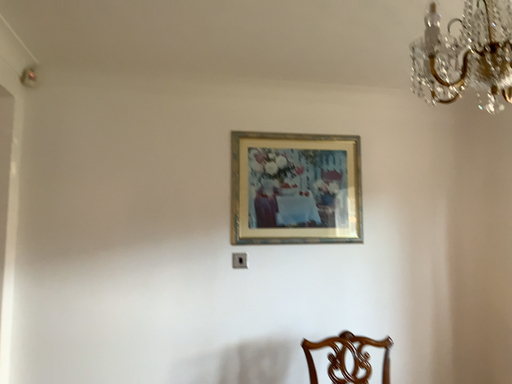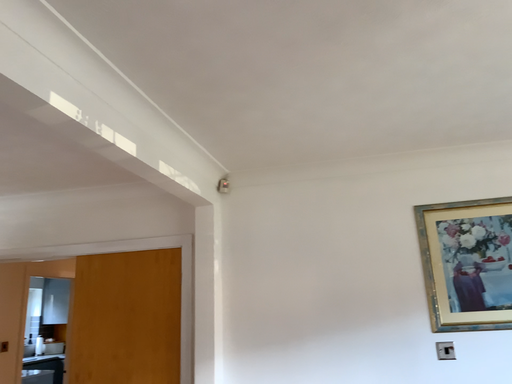
Question: How did the camera likely rotate when shooting the video?

Choices:
 (A) rotated upward
 (B) rotated downward

Answer: (A)